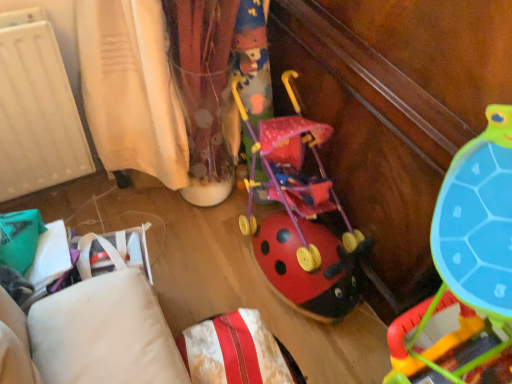
Question: In which direction should I rotate to look at matte plastic stroller at center, the second toy in the bottom-to-top sequence?

Choices:
 (A) left
 (B) right

Answer: (B)

Question: From the image's perspective, would you say matte plastic stroller at center, the second toy in the bottom-to-top sequence, is positioned over velvety white pillow at lower center?

Choices:
 (A) yes
 (B) no

Answer: (A)

Question: Is matte plastic stroller at center, the second toy in the bottom-to-top sequence, oriented towards velvety white pillow at lower center?

Choices:
 (A) no
 (B) yes

Answer: (A)

Question: From the image's perspective, is matte plastic stroller at center, the 1th toy in the top-to-bottom sequence, beneath velvety white pillow at lower center?

Choices:
 (A) yes
 (B) no

Answer: (B)

Question: Does matte plastic stroller at center, the 1th toy in the top-to-bottom sequence, come behind velvety white pillow at lower center?

Choices:
 (A) yes
 (B) no

Answer: (A)

Question: From a real-world perspective, is matte plastic stroller at center, the second toy in the bottom-to-top sequence, located beneath velvety white pillow at lower center?

Choices:
 (A) no
 (B) yes

Answer: (A)

Question: Is there a large distance between matte plastic stroller at center, the second toy in the bottom-to-top sequence, and velvety white pillow at lower center?

Choices:
 (A) yes
 (B) no

Answer: (B)

Question: Can you confirm if rubberized plastic ladybug stroller at center, the 2th toy viewed from the top, is smaller than velvety white pillow at lower center?

Choices:
 (A) no
 (B) yes

Answer: (A)

Question: Can you confirm if rubberized plastic ladybug stroller at center, arranged as the first toy when ordered from the bottom, is thinner than velvety white pillow at lower center?

Choices:
 (A) yes
 (B) no

Answer: (B)

Question: Is rubberized plastic ladybug stroller at center, the 2th toy viewed from the top, bigger than velvety white pillow at lower center?

Choices:
 (A) yes
 (B) no

Answer: (A)

Question: Is rubberized plastic ladybug stroller at center, arranged as the first toy when ordered from the bottom, turned away from velvety white pillow at lower center?

Choices:
 (A) yes
 (B) no

Answer: (B)

Question: Considering the relative sizes of rubberized plastic ladybug stroller at center, the 2th toy viewed from the top, and velvety white pillow at lower center in the image provided, is rubberized plastic ladybug stroller at center, the 2th toy viewed from the top, shorter than velvety white pillow at lower center?

Choices:
 (A) yes
 (B) no

Answer: (B)

Question: Is rubberized plastic ladybug stroller at center, arranged as the first toy when ordered from the bottom, positioned behind velvety white pillow at lower center?

Choices:
 (A) no
 (B) yes

Answer: (A)

Question: Is velvety white pillow at lower center facing away from rubberized plastic ladybug stroller at center, arranged as the first toy when ordered from the bottom?

Choices:
 (A) no
 (B) yes

Answer: (A)